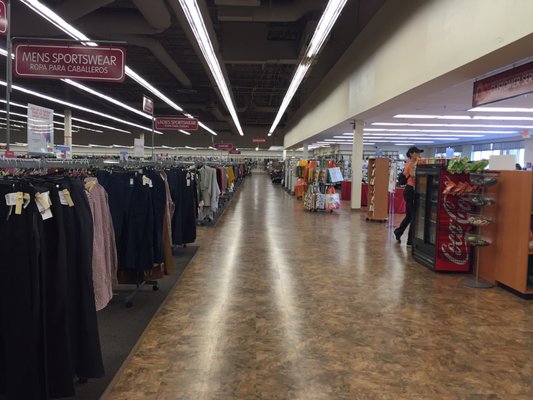
Identify the location of carpet. (130, 324).